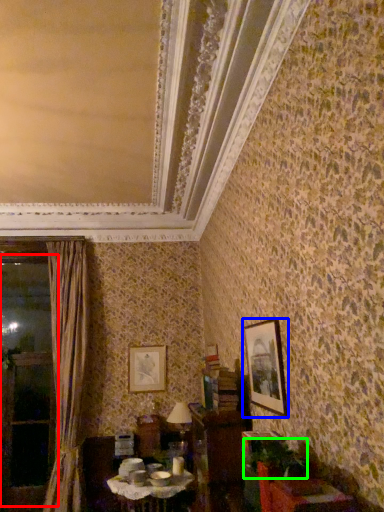
Question: Considering the real-world distances, which object is closest to window (highlighted by a red box)? picture frame (highlighted by a blue box) or plant (highlighted by a green box).

Choices:
 (A) picture frame
 (B) plant

Answer: (A)